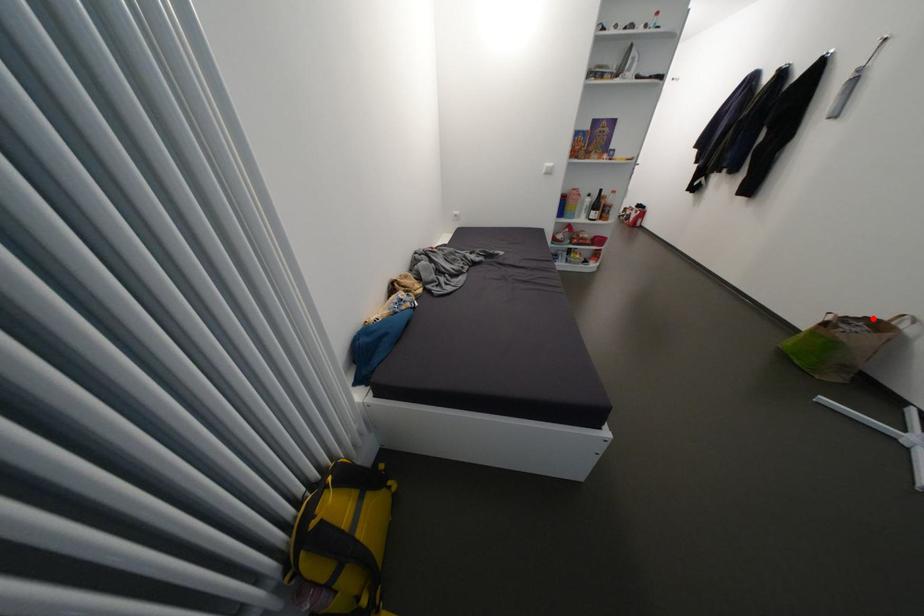
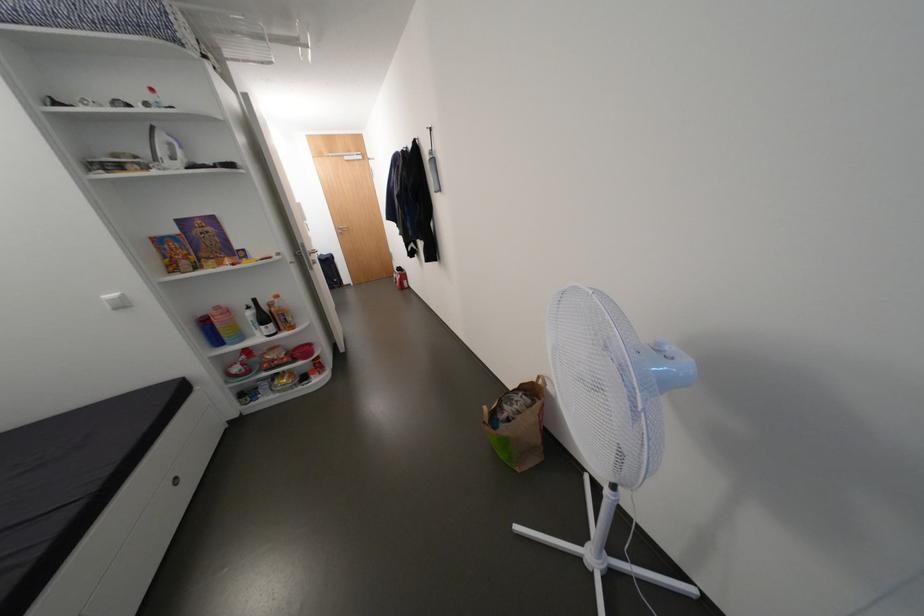
Find the pixel in the second image that matches the highlighted location in the first image.

(529, 386)